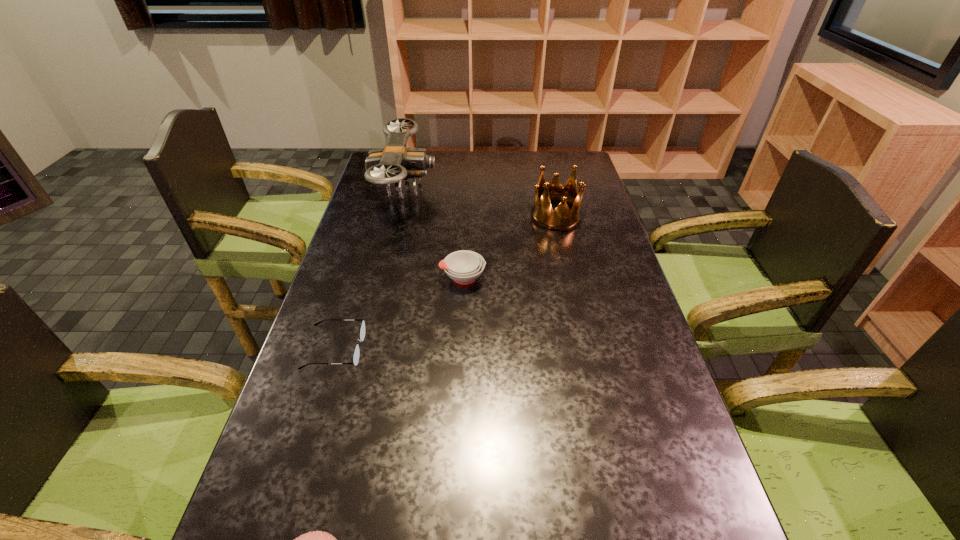
Locate which object is the fourth closest to the drone. Please provide its 2D coordinates. Your answer should be formatted as a tuple, i.e. [(x, y)], where the tuple contains the x and y coordinates of a point satisfying the conditions above.

[(317, 539)]

This screenshot has width=960, height=540. What are the coordinates of `object that is the fourth closest to the drone` in the screenshot? It's located at (317, 539).

Locate an element on the screen. The height and width of the screenshot is (540, 960). vacant space that satisfies the following two spatial constraints: 1. on the front-facing side of the third shortest object; 2. on the right side of the drone is located at coordinates (383, 277).

The image size is (960, 540). In order to click on vacant space that satisfies the following two spatial constraints: 1. on the back side of the soup bowl; 2. on the right side of the second tallest object in this screenshot , I will do `click(466, 216)`.

Find the location of `vacant area that satisfies the following two spatial constraints: 1. on the front side of the second tallest object; 2. on the lenses of the second nearest object`. vacant area that satisfies the following two spatial constraints: 1. on the front side of the second tallest object; 2. on the lenses of the second nearest object is located at coordinates (586, 349).